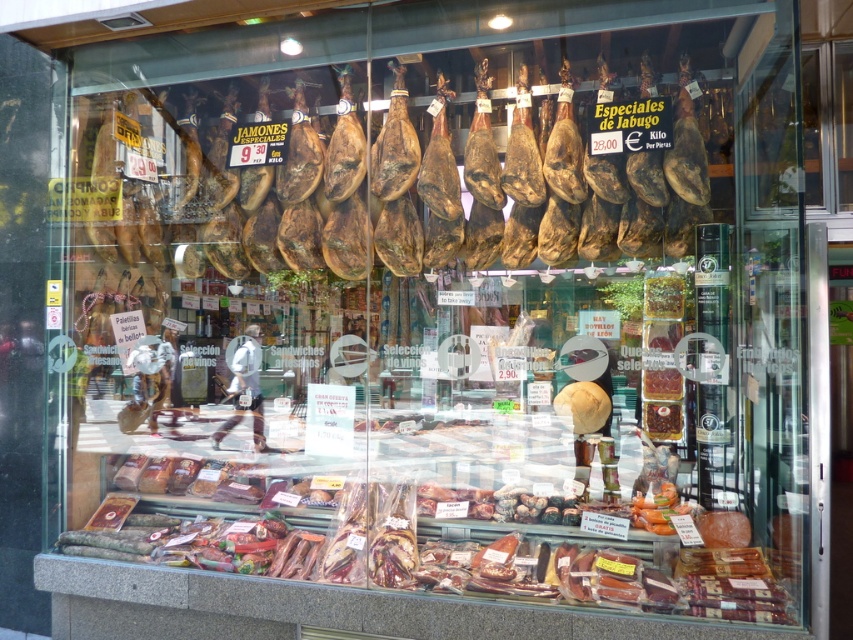
Does brown leather ham at center have a lesser height compared to shiny brown meat at center?

In fact, brown leather ham at center may be taller than shiny brown meat at center.

Describe the element at coordinates (401, 177) in the screenshot. I see `brown leather ham at center` at that location.

At what (x,y) coordinates should I click in order to perform the action: click on brown leather ham at center. Please return your answer as a coordinate pair (x, y). Looking at the image, I should click on (401, 177).